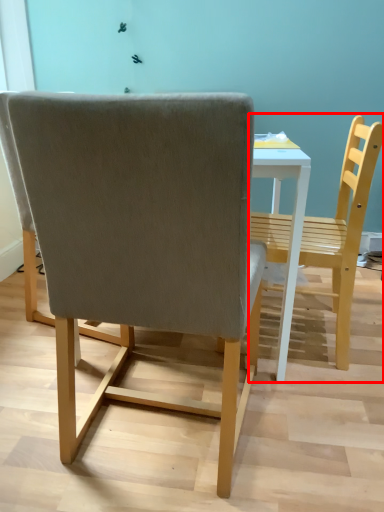
Question: In this image, where is chair (annotated by the red box) located relative to chair?

Choices:
 (A) left
 (B) right

Answer: (B)